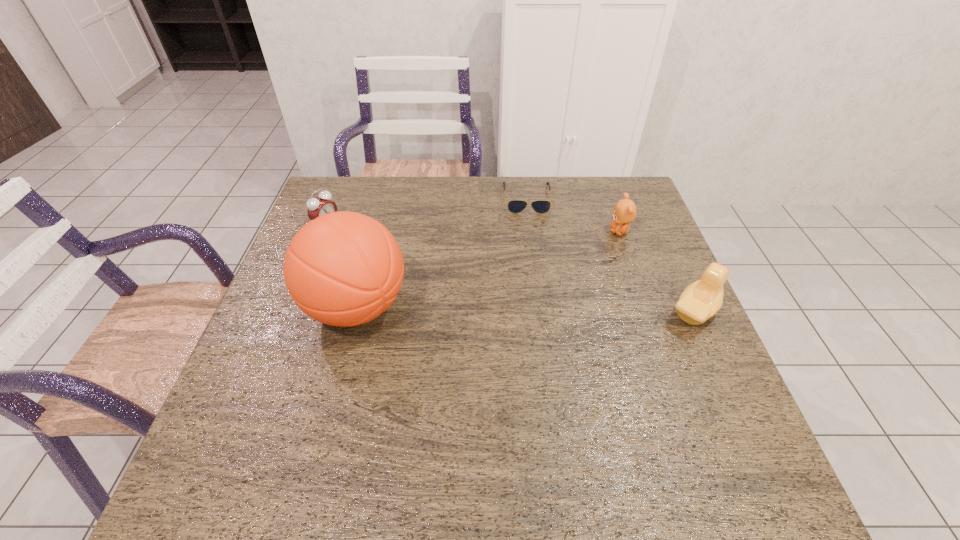
Where is `free space between the shortest object and the teddy bear`? The width and height of the screenshot is (960, 540). free space between the shortest object and the teddy bear is located at coordinates (573, 215).

Image resolution: width=960 pixels, height=540 pixels. In order to click on empty space that is in between the basketball and the fourth object from left to right in this screenshot , I will do `click(488, 269)`.

In order to click on free space between the teddy bear and the alarm clock in this screenshot , I will do `click(473, 228)`.

This screenshot has height=540, width=960. What are the coordinates of `vacant space that's between the sunglasses and the alarm clock` in the screenshot? It's located at (427, 211).

Identify the location of unoccupied area between the sunglasses and the teddy bear. The width and height of the screenshot is (960, 540). (573, 215).

Locate an element on the screen. The width and height of the screenshot is (960, 540). free space that is in between the third object from right to left and the alarm clock is located at coordinates (427, 211).

Identify the location of free space between the sunglasses and the duck. [611, 255].

Image resolution: width=960 pixels, height=540 pixels. In order to click on empty space that is in between the fourth object from left to right and the alarm clock in this screenshot , I will do `click(473, 228)`.

In order to click on vacant space that is in between the sunglasses and the tallest object in this screenshot , I will do `click(442, 253)`.

Locate an element on the screen. object that is the second closest to the teddy bear is located at coordinates click(x=702, y=299).